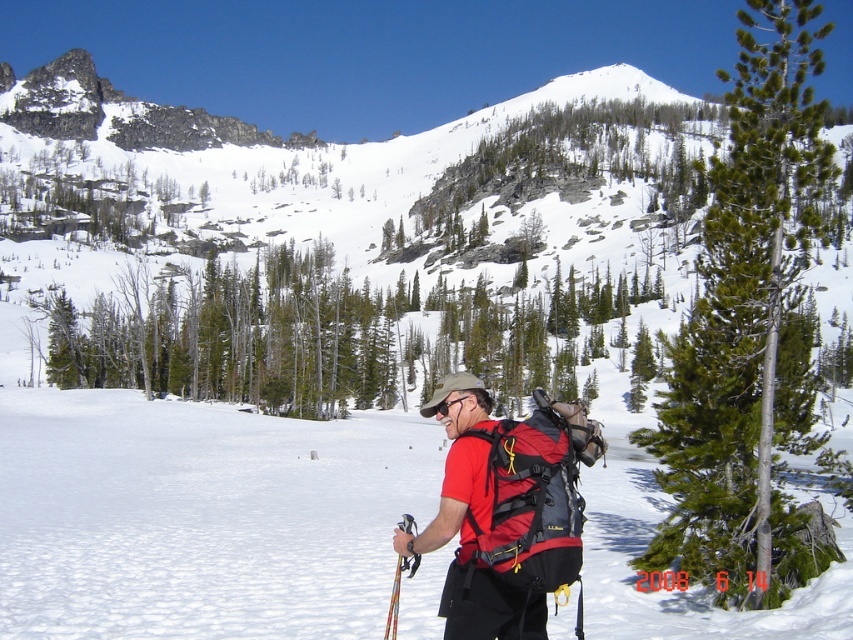
Is green needle-like at center smaller than red matte backpack at center?

No.

Which of these two, green needle-like at center or red matte backpack at center, stands taller?

green needle-like at center is taller.

The width and height of the screenshot is (853, 640). In order to click on green needle-like at center in this screenshot , I will do `click(747, 326)`.